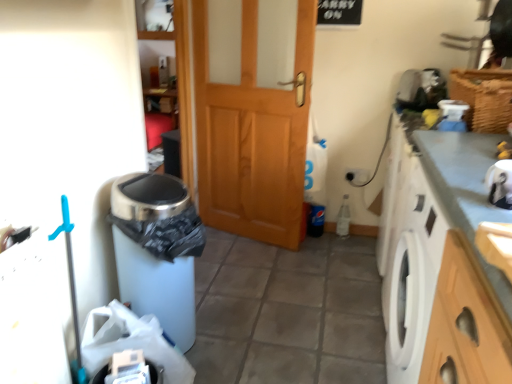
The height and width of the screenshot is (384, 512). What do you see at coordinates (252, 135) in the screenshot?
I see `wooden door at center` at bounding box center [252, 135].

What are the coordinates of `smooth gray countertop at right` in the screenshot? It's located at (442, 266).

Considering the positions of points (478, 100) and (269, 196), is point (478, 100) closer to camera compared to point (269, 196)?

That is True.

Is woven brown basket at upper right taller or shorter than wooden door at center?

Clearly, woven brown basket at upper right is shorter compared to wooden door at center.

Is woven brown basket at upper right next to wooden door at center and touching it?

No, woven brown basket at upper right is not in contact with wooden door at center.

In the image, is woven brown basket at upper right positioned in front of or behind wooden door at center?

In the image, woven brown basket at upper right appears in front of wooden door at center.

From the image's perspective, is white matte trash can at lower left on top of wooden door at center?

Incorrect, from the image's perspective, white matte trash can at lower left is lower than wooden door at center.

Is white matte trash can at lower left positioned behind wooden door at center?

No, the depth of white matte trash can at lower left is less than that of wooden door at center.

Can you tell me how much white matte trash can at lower left and wooden door at center differ in facing direction?

They differ by 162 degrees in their facing directions.

Considering the sizes of objects white matte trash can at lower left and woven brown basket at upper right in the image provided, who is smaller, white matte trash can at lower left or woven brown basket at upper right?

With smaller size is woven brown basket at upper right.

Which point is more distant from viewer, (292,380) or (460,75)?

The point (460,75) is more distant.

From a real-world perspective, between white matte trash can at lower left and woven brown basket at upper right, who is vertically lower?

white matte trash can at lower left is physically lower.

From the image's perspective, which is below, white matte trash can at lower left or woven brown basket at upper right?

white matte trash can at lower left.

Between wooden door at center and white matte trash can at lower left, which one has less height?

With less height is white matte trash can at lower left.

From a real-world perspective, does wooden door at center stand above white matte trash can at lower left?

Correct, in the physical world, wooden door at center is higher than white matte trash can at lower left.

Find the location of a particular element. The image size is (512, 384). tile below the wooden door at center (from the image's perspective) is located at coordinates (288, 312).

In the scene shown: Is white plastic bag at lower left turned away from white matte trash can at lower left?

No, white plastic bag at lower left is not facing away from white matte trash can at lower left.

Identify the location of tile above the white plastic bag at lower left (from the image's perspective). Image resolution: width=512 pixels, height=384 pixels. (288, 312).

Considering the sizes of objects white plastic bag at lower left and white matte trash can at lower left in the image provided, who is bigger, white plastic bag at lower left or white matte trash can at lower left?

Bigger between the two is white matte trash can at lower left.

Considering the relative positions of white plastic bag at lower left and white matte trash can at lower left in the image provided, is white plastic bag at lower left to the left of white matte trash can at lower left from the viewer's perspective?

Yes, white plastic bag at lower left is to the left of white matte trash can at lower left.

From the image's perspective, which is below, wooden door at center or smooth gray countertop at right?

From the image's view, smooth gray countertop at right is below.

Who is bigger, wooden door at center or smooth gray countertop at right?

With larger size is smooth gray countertop at right.

Which is in front, point (247, 159) or point (425, 203)?

The point (425, 203) is more forward.

From a real-world perspective, is smooth gray countertop at right physically above woven brown basket at upper right?

No, from a real-world perspective, smooth gray countertop at right is not above woven brown basket at upper right.

Based on their sizes in the image, would you say smooth gray countertop at right is bigger or smaller than woven brown basket at upper right?

Clearly, smooth gray countertop at right is larger in size than woven brown basket at upper right.

In the scene shown: In terms of width, does smooth gray countertop at right look wider or thinner when compared to woven brown basket at upper right?

Considering their sizes, smooth gray countertop at right looks broader than woven brown basket at upper right.

Which point is more distant from viewer, (477, 219) or (482, 120)?

The point (482, 120) is farther.

At what (x,y) coordinates should I click in order to perform the action: click on basket above the wooden door at center (from the image's perspective). Please return your answer as a coordinate pair (x, y). Looking at the image, I should click on (484, 98).

Image resolution: width=512 pixels, height=384 pixels. What are the coordinates of `door that appears on the left of white matte trash can at lower left` in the screenshot? It's located at (252, 135).

From the image, which object appears to be nearer to white matte trash can at lower left, wooden door at center or smooth gray countertop at right?

smooth gray countertop at right.

Which object lies further to the anchor point woven brown basket at upper right, white matte trash can at lower left or smooth gray countertop at right?

white matte trash can at lower left lies further to woven brown basket at upper right than the other object.

Looking at the image, which one is located further to white plastic bag at lower left, woven brown basket at upper right or smooth gray countertop at right?

woven brown basket at upper right lies further to white plastic bag at lower left than the other object.

Looking at the image, which one is located further to wooden door at center, white matte trash can at lower left or white plastic bag at lower left?

white plastic bag at lower left lies further to wooden door at center than the other object.

When comparing their distances from woven brown basket at upper right, does wooden door at center or white matte trash can at lower left seem closer?

wooden door at center is positioned closer to the anchor woven brown basket at upper right.

Estimate the real-world distances between objects in this image. Which object is closer to white plastic bag at lower left, white matte trash can at lower left or woven brown basket at upper right?

The object closer to white plastic bag at lower left is white matte trash can at lower left.

Looking at this image, based on their spatial positions, is white plastic bag at lower left or woven brown basket at upper right further from wooden door at center?

white plastic bag at lower left is positioned further to the anchor wooden door at center.

Estimate the real-world distances between objects in this image. Which object is further from wooden door at center, white plastic bag at lower left or smooth gray countertop at right?

white plastic bag at lower left lies further to wooden door at center than the other object.

This screenshot has height=384, width=512. I want to click on basket between smooth gray countertop at right and wooden door at center in the front-back direction, so click(x=484, y=98).

The width and height of the screenshot is (512, 384). Find the location of `tile between wooden door at center and woven brown basket at upper right from left to right`. tile between wooden door at center and woven brown basket at upper right from left to right is located at coordinates (288, 312).

Identify the location of counter top between white plastic bag at lower left and woven brown basket at upper right. The image size is (512, 384). (442, 266).

I want to click on tile positioned between smooth gray countertop at right and wooden door at center from near to far, so click(288, 312).